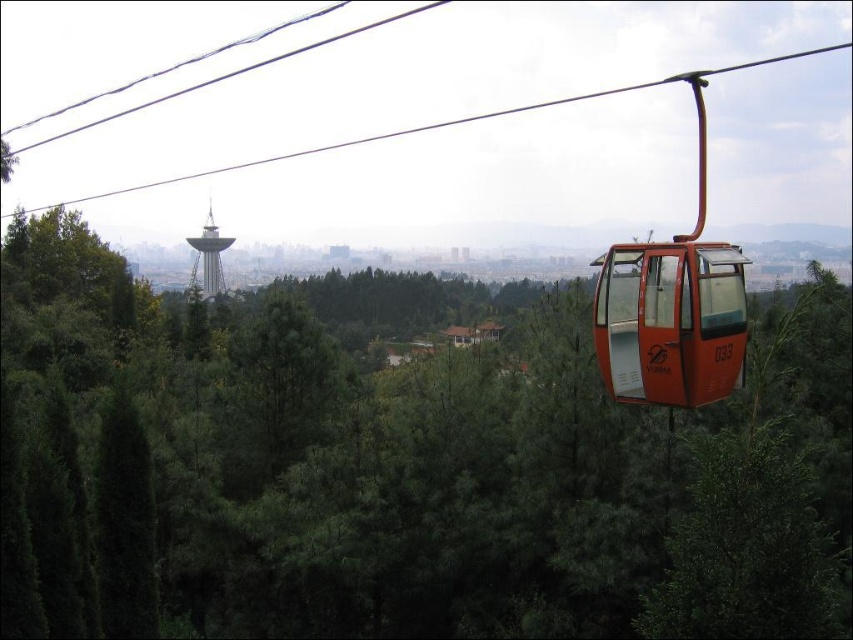
You are a tourist in the cable car and want to take a photo of the metallic silver tower at center. However, the orange cable car at upper center is blocking your view. Can you estimate if the tower is narrower than the cable car?

The orange cable car at upper center is wider than the metallic silver tower at center, so the tower is narrower than the cable car. Therefore, the tower might still be partially visible if you adjust your angle slightly to account for its narrower width.

You are a passenger in the cable car and want to know which of the two points, point (x=386, y=136) or point (x=224, y=285), is closer to you. Based on the scene, can you determine which point is nearer?

Point (x=386, y=136) is further to the viewer than point (x=224, y=285), so the point (x=224, y=285) is closer to you.